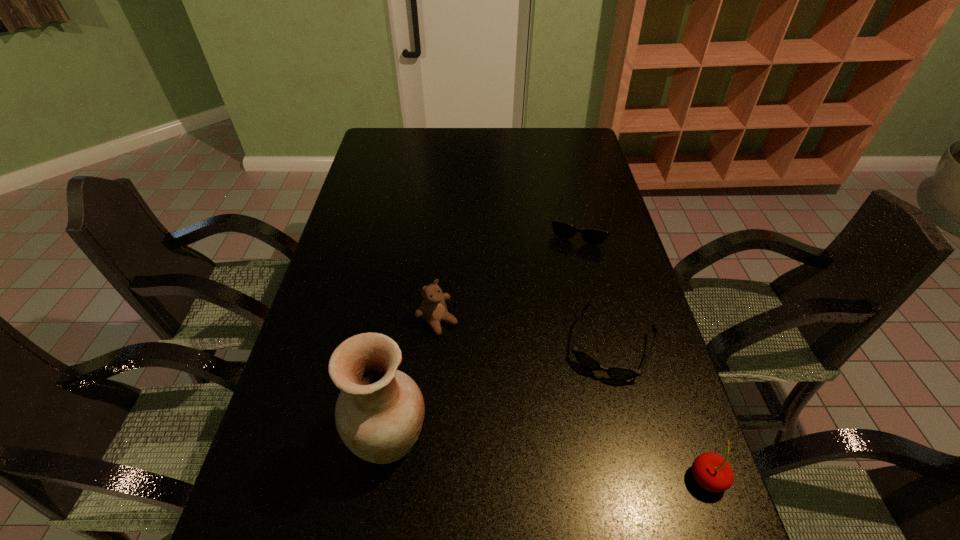
At what (x,y) coordinates should I click in order to perform the action: click on vacant space located 0.130m on the front-facing side of the teddy bear. Please return your answer as a coordinate pair (x, y). Looking at the image, I should click on (483, 367).

Locate an element on the screen. blank space located 0.380m on the front-facing side of the teddy bear is located at coordinates (561, 444).

You are a GUI agent. You are given a task and a screenshot of the screen. Output one action in this format:
    pyautogui.click(x=<x>, y=<y>)
    Task: Click on the vacant space located 0.240m on the front-facing side of the teddy bear
    This screenshot has width=960, height=540.
    Given the screenshot: What is the action you would take?
    pyautogui.click(x=515, y=398)

Image resolution: width=960 pixels, height=540 pixels. In order to click on vacant space positioned on the lenses of the nearer sunglasses in this screenshot , I will do `click(574, 465)`.

This screenshot has width=960, height=540. I want to click on vacant space positioned on the lenses of the nearer sunglasses, so 588,420.

Where is `free space located 0.240m on the lenses of the nearer sunglasses`? free space located 0.240m on the lenses of the nearer sunglasses is located at coordinates (571, 475).

At what (x,y) coordinates should I click in order to perform the action: click on pottery that is at the near edge. Please return your answer as a coordinate pair (x, y). The height and width of the screenshot is (540, 960). Looking at the image, I should click on (379, 413).

Locate an element on the screen. cherry present at the near edge is located at coordinates (711, 471).

At what (x,y) coordinates should I click in order to perform the action: click on cherry present at the right edge. Please return your answer as a coordinate pair (x, y). Image resolution: width=960 pixels, height=540 pixels. Looking at the image, I should click on (711, 471).

The height and width of the screenshot is (540, 960). In order to click on object that is at the near right corner in this screenshot , I will do `click(711, 471)`.